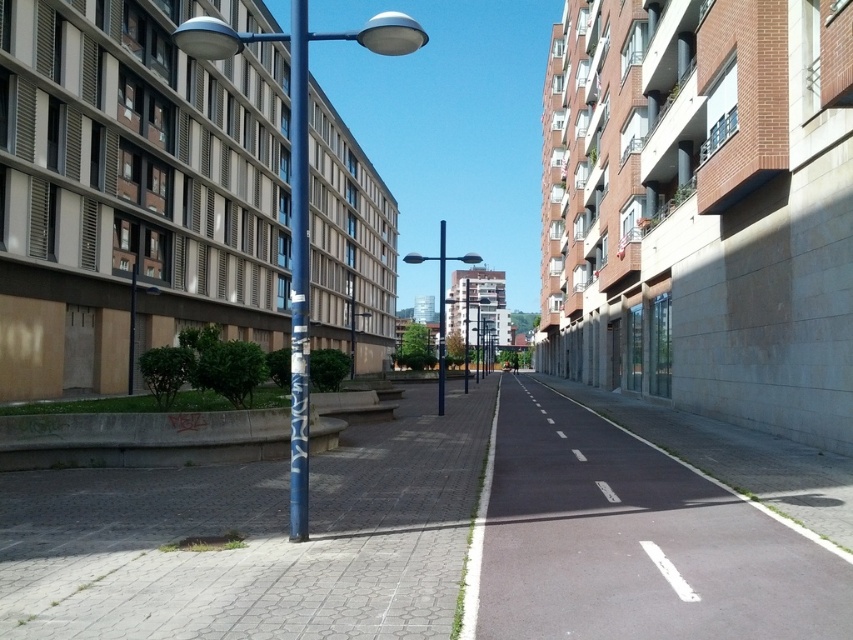
Question: Which object appears farthest from the camera in this image?

Choices:
 (A) metallic pole at center
 (B) gray brick pavement at lower left

Answer: (A)

Question: Is blue metallic pole at center positioned in front of blue painted metal pole at center?

Choices:
 (A) yes
 (B) no

Answer: (B)

Question: Is the position of gray brick pavement at lower left more distant than that of metallic pole at center?

Choices:
 (A) no
 (B) yes

Answer: (A)

Question: Which object is the farthest from the gray brick pavement at lower left?

Choices:
 (A) black asphalt bike lane at center
 (B) blue painted metal pole at center
 (C) metallic pole at center

Answer: (C)

Question: Which is nearer to the gray brick pavement at lower left?

Choices:
 (A) smooth blue pole at center
 (B) blue painted metal pole at center

Answer: (B)

Question: Does blue metallic pole at center have a smaller size compared to metallic pole at center?

Choices:
 (A) yes
 (B) no

Answer: (B)